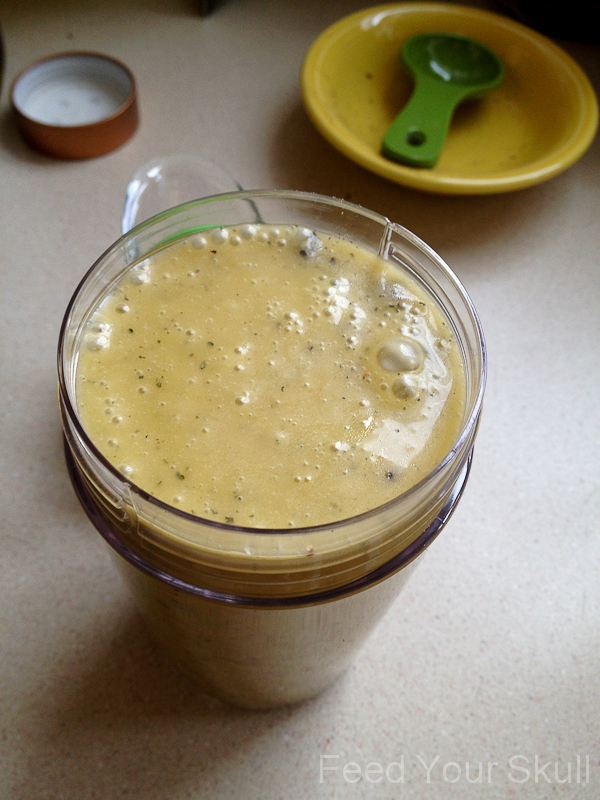
Locate an element on the screen. countertop is located at coordinates (512, 581).